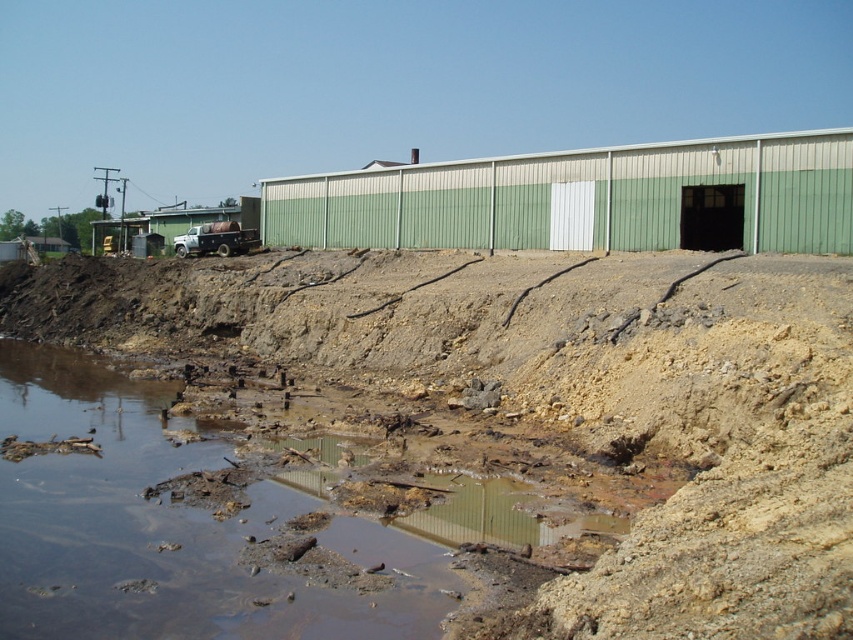
You are standing at the center of the image and want to avoid the unstable area. Which direction should you move to stay away from the dull brown dirt at lower left?

You should move away from the dull brown dirt at lower left by heading in the opposite direction, which would be towards the upper right.

You are standing at the point marked as point (561, 400) in the lower left corner of the image. You want to walk to the entrance of the building with the open doorway on the right side. Which direction should you head towards?

You should head towards the right side since the entrance of the building with the open doorway is on the right side, and the point is located at the lower left.